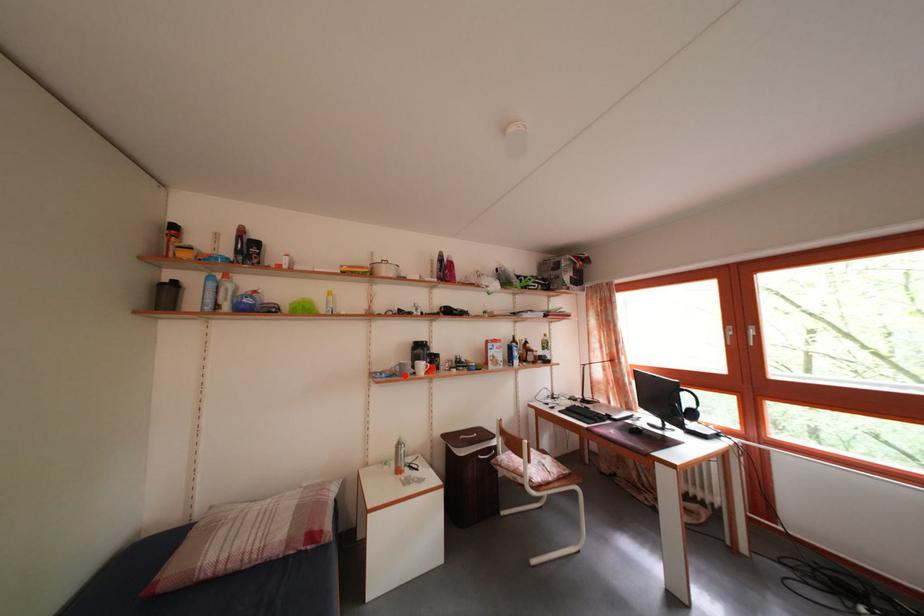
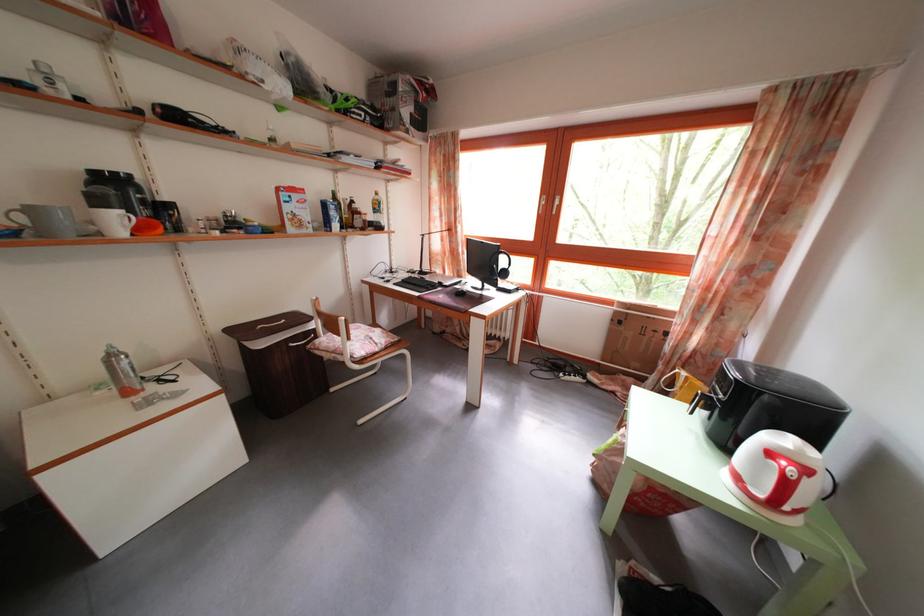
Locate, in the second image, the point that corresponds to the highlighted location in the first image.

(30, 225)